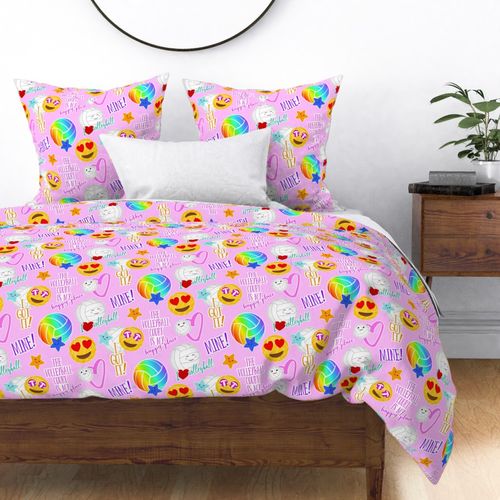
The width and height of the screenshot is (500, 500). Find the location of `white sheet`. white sheet is located at coordinates (354, 211).